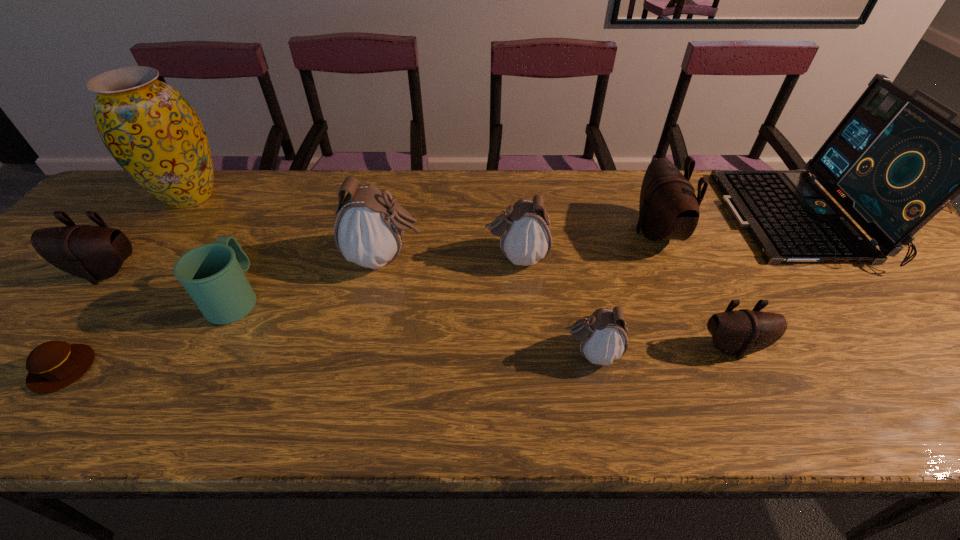
Where is `vacant space that satisfies the following two spatial constraints: 1. on the front-facing side of the rightmost object; 2. with the flap open on the smallest brown pouch`? vacant space that satisfies the following two spatial constraints: 1. on the front-facing side of the rightmost object; 2. with the flap open on the smallest brown pouch is located at coordinates (901, 347).

Where is `free location that satisfies the following two spatial constraints: 1. on the front-facing side of the rightmost object; 2. with the flap open on the nearest brown pouch`? This screenshot has height=540, width=960. free location that satisfies the following two spatial constraints: 1. on the front-facing side of the rightmost object; 2. with the flap open on the nearest brown pouch is located at coordinates [x=901, y=347].

You are a GUI agent. You are given a task and a screenshot of the screen. Output one action in this format:
    pyautogui.click(x=<x>, y=<y>)
    Task: Click on the vacant region that satisfies the following two spatial constraints: 1. on the front-facing side of the rightmost object; 2. with the flap open on the leftmost brown pouch
    
    Given the screenshot: What is the action you would take?
    pyautogui.click(x=841, y=273)